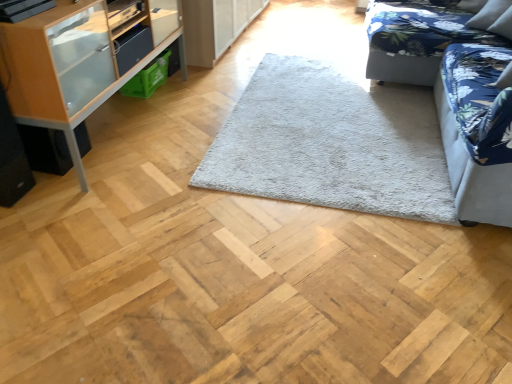
Question: Considering the relative sizes of gray fluffy rug at center and blue floral fabric couch at upper right, the 2th studio couch positioned from the front, in the image provided, is gray fluffy rug at center thinner than blue floral fabric couch at upper right, the 2th studio couch positioned from the front,?

Choices:
 (A) yes
 (B) no

Answer: (B)

Question: Is gray fluffy rug at center positioned in front of blue floral fabric couch at upper right, the first studio couch in the back-to-front sequence?

Choices:
 (A) yes
 (B) no

Answer: (A)

Question: Is gray fluffy rug at center turned away from blue floral fabric couch at upper right, the first studio couch in the back-to-front sequence?

Choices:
 (A) yes
 (B) no

Answer: (B)

Question: Considering the relative sizes of gray fluffy rug at center and blue floral fabric couch at upper right, the 2th studio couch positioned from the front, in the image provided, is gray fluffy rug at center wider than blue floral fabric couch at upper right, the 2th studio couch positioned from the front,?

Choices:
 (A) yes
 (B) no

Answer: (A)

Question: Is gray fluffy rug at center next to blue floral fabric couch at upper right, the first studio couch in the back-to-front sequence, and touching it?

Choices:
 (A) yes
 (B) no

Answer: (B)

Question: Considering their positions, is wooden cabinet at left located in front of or behind matte black drawer at upper left?

Choices:
 (A) behind
 (B) front

Answer: (B)

Question: From a real-world perspective, is wooden cabinet at left positioned above or below matte black drawer at upper left?

Choices:
 (A) above
 (B) below

Answer: (B)

Question: Considering the positions of point (91, 49) and point (130, 49), is point (91, 49) closer or farther from the camera than point (130, 49)?

Choices:
 (A) closer
 (B) farther

Answer: (A)

Question: Visually, is wooden cabinet at left positioned to the left or to the right of matte black drawer at upper left?

Choices:
 (A) right
 (B) left

Answer: (B)

Question: Considering the positions of gray fluffy rug at center and wooden cabinet at left in the image, is gray fluffy rug at center taller or shorter than wooden cabinet at left?

Choices:
 (A) tall
 (B) short

Answer: (B)

Question: From a real-world perspective, is gray fluffy rug at center positioned above or below wooden cabinet at left?

Choices:
 (A) below
 (B) above

Answer: (A)

Question: Considering the relative positions of gray fluffy rug at center and wooden cabinet at left in the image provided, is gray fluffy rug at center to the left or to the right of wooden cabinet at left?

Choices:
 (A) left
 (B) right

Answer: (B)

Question: Is gray fluffy rug at center wider or thinner than wooden cabinet at left?

Choices:
 (A) thin
 (B) wide

Answer: (B)

Question: Considering the positions of point (148, 39) and point (79, 1), is point (148, 39) closer or farther from the camera than point (79, 1)?

Choices:
 (A) closer
 (B) farther

Answer: (B)

Question: Considering the positions of matte black drawer at upper left and wooden cabinet at left in the image, is matte black drawer at upper left taller or shorter than wooden cabinet at left?

Choices:
 (A) short
 (B) tall

Answer: (A)